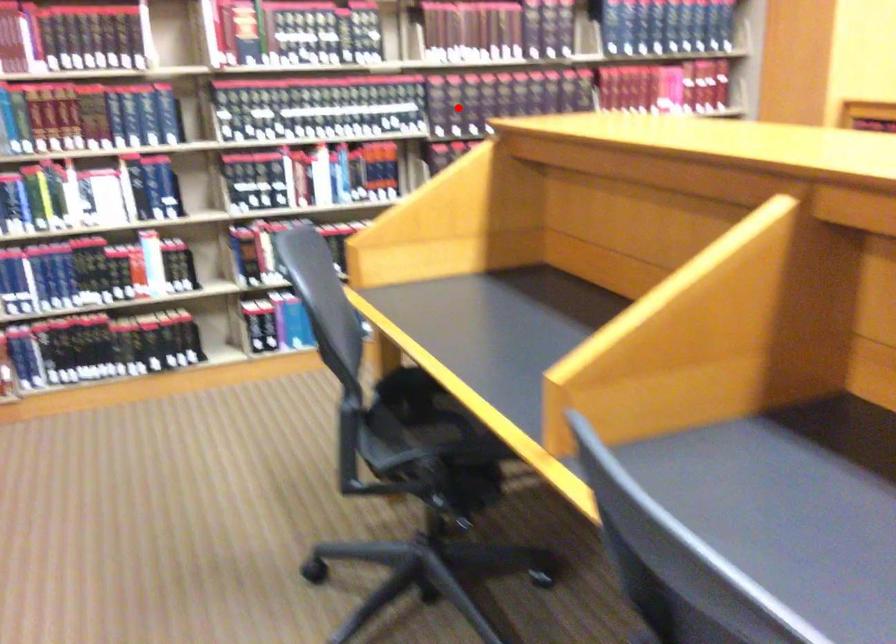
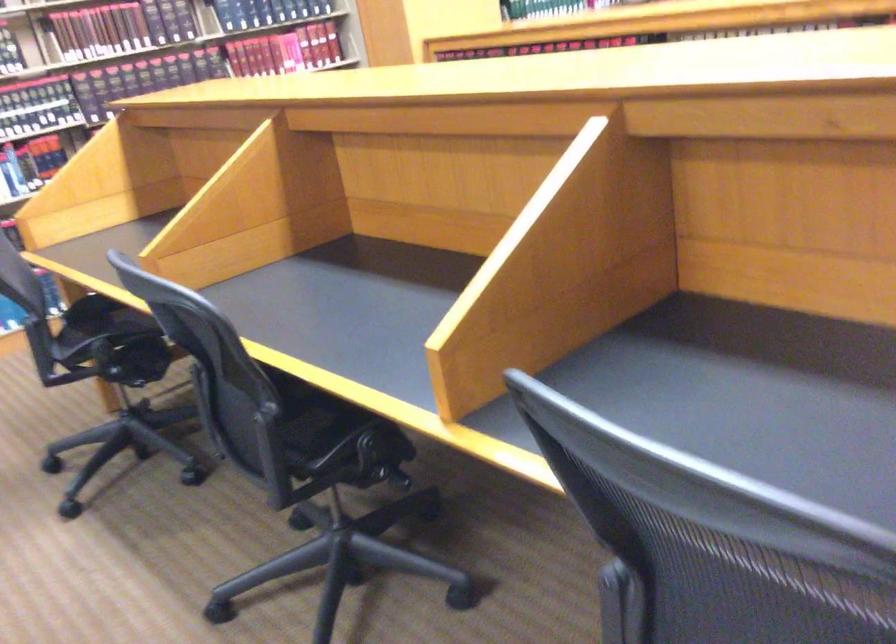
The point at the highlighted location is marked in the first image. Where is the corresponding point in the second image?

(99, 89)